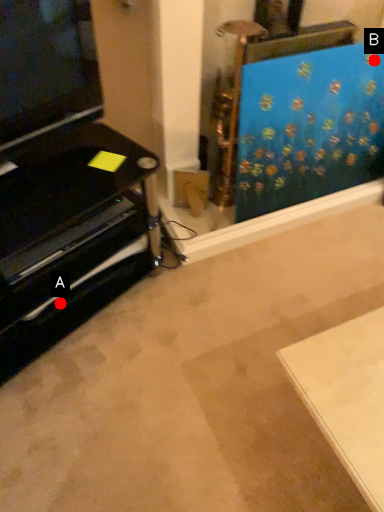
Question: Two points are circled on the image, labeled by A and B beside each circle. Which point is closer to the camera taking this photo?

Choices:
 (A) A is closer
 (B) B is closer

Answer: (A)